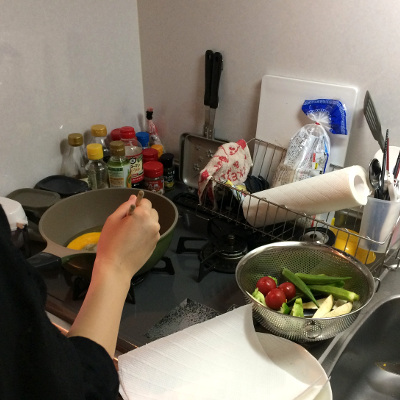
You are a GUI agent. You are given a task and a screenshot of the screen. Output one action in this format:
    pyautogui.click(x=<x>, y=<y>)
    Task: Click on the burner
    This screenshot has width=400, height=400.
    Given the screenshot: What is the action you would take?
    pyautogui.click(x=227, y=245)